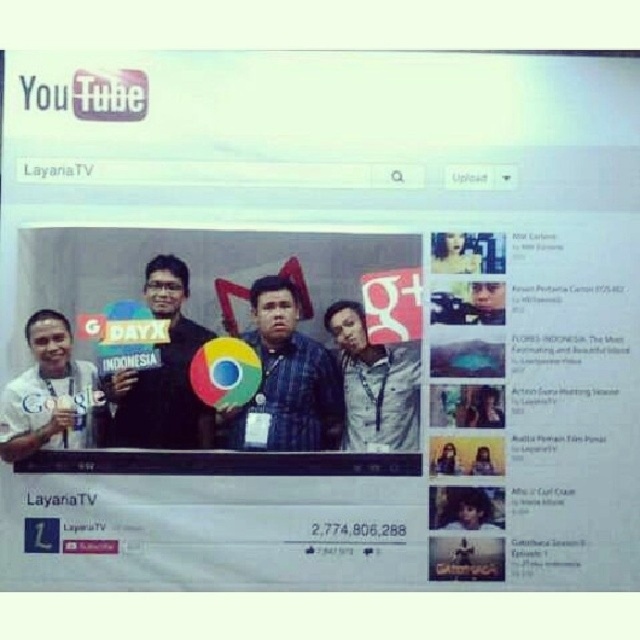
Consider the image. You are designing a layout for a YouTube banner and want to ensure that the two central shirts, the matte blue shirt at center and the black matte shirt at center, are proportionally sized. Based on the image provided, which shirt has a greater width?

The matte blue shirt at center has a greater width than the black matte shirt at center according to the description.

You are a fashion designer analyzing the clothing in the image. You notice two shirts, the matte blue shirt at center and the black matte shirt at center. Which shirt is positioned lower on the person?

The matte blue shirt at center is located below the black matte shirt at center, so the matte blue shirt at center is positioned lower.

You are trying to determine which of the two shirts in the image is smaller. You see the matte blue shirt at center and the black matte shirt at center. Which one has a smaller size?

The matte blue shirt at center is smaller than the black matte shirt at center.